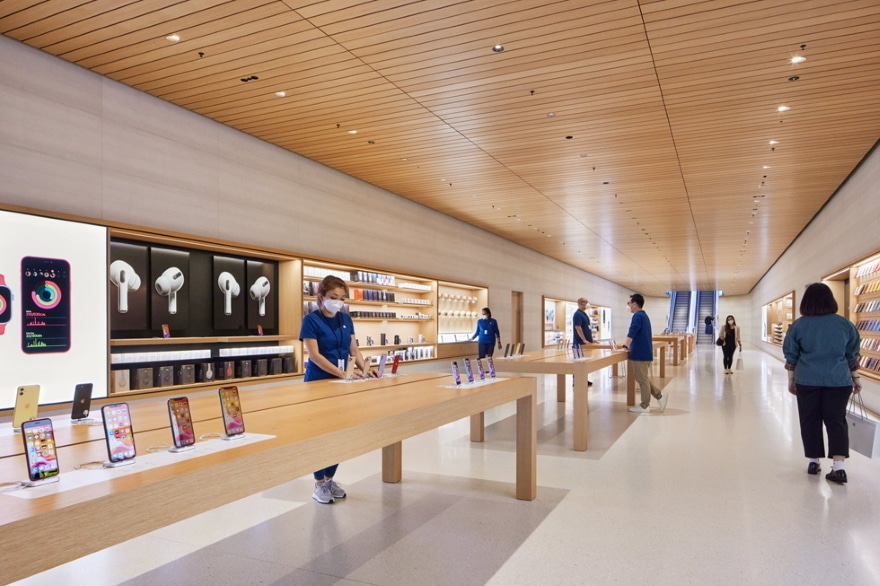
Locate an element on the screen. This screenshot has width=880, height=586. ceiling is located at coordinates (631, 119).